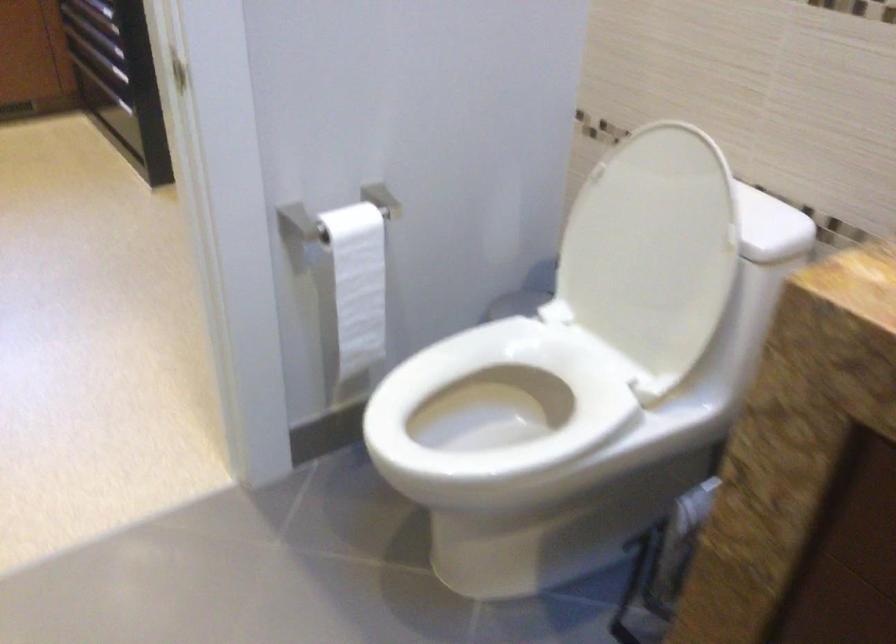
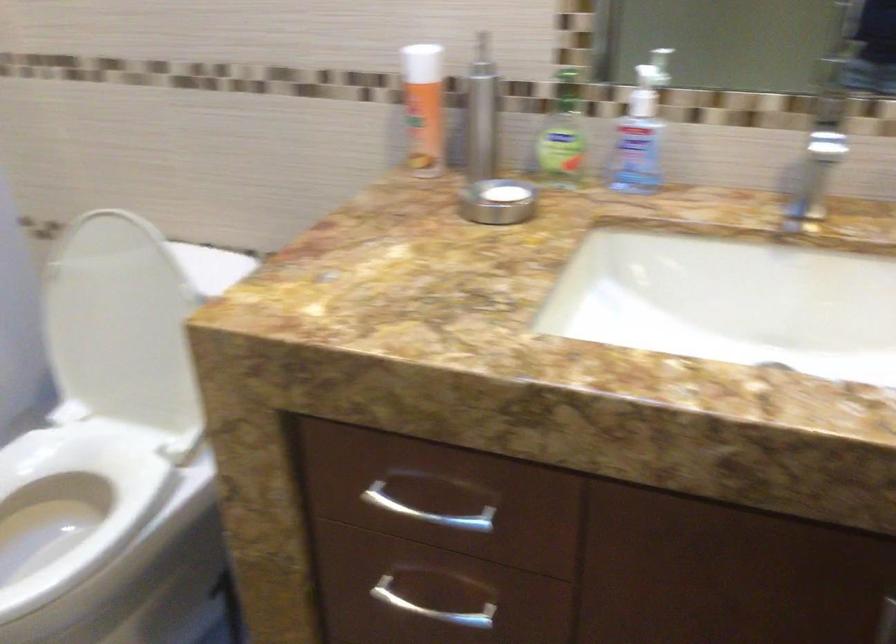
Question: The first image is from the beginning of the video and the second image is from the end. How did the camera likely rotate when shooting the video?

Choices:
 (A) Left
 (B) Right
 (C) Up
 (D) Down

Answer: (B)